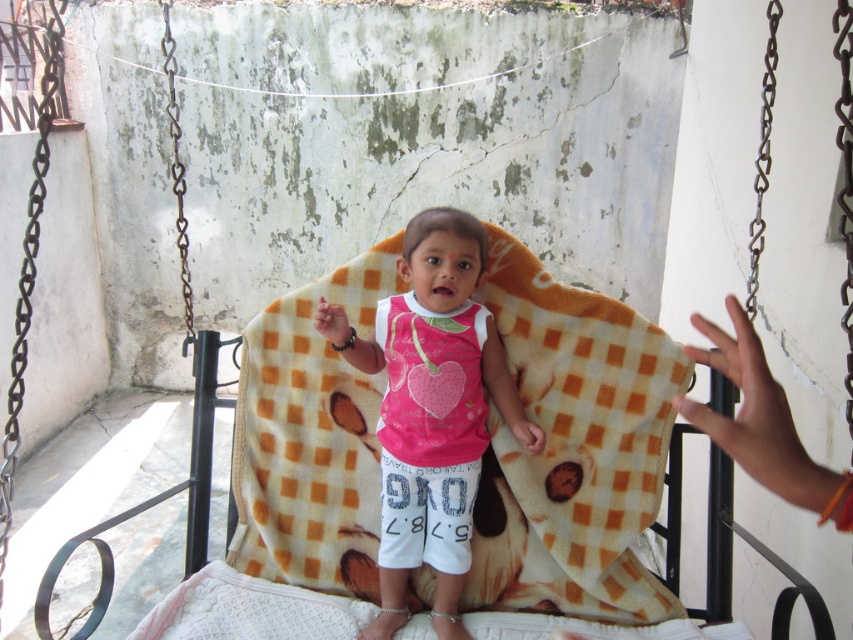
Question: Does orange checkered blanket at center have a smaller size compared to pink fleece shirt at center?

Choices:
 (A) yes
 (B) no

Answer: (B)

Question: Is orange checkered blanket at center thinner than pink fleece shirt at center?

Choices:
 (A) yes
 (B) no

Answer: (B)

Question: Which of the following is the closest to the observer?

Choices:
 (A) orange checkered blanket at center
 (B) pink fleece shirt at center

Answer: (B)

Question: Which of the following is the farthest from the observer?

Choices:
 (A) pink fleece shirt at center
 (B) orange checkered blanket at center

Answer: (B)

Question: Does orange checkered blanket at center appear on the left side of pink fleece shirt at center?

Choices:
 (A) yes
 (B) no

Answer: (B)